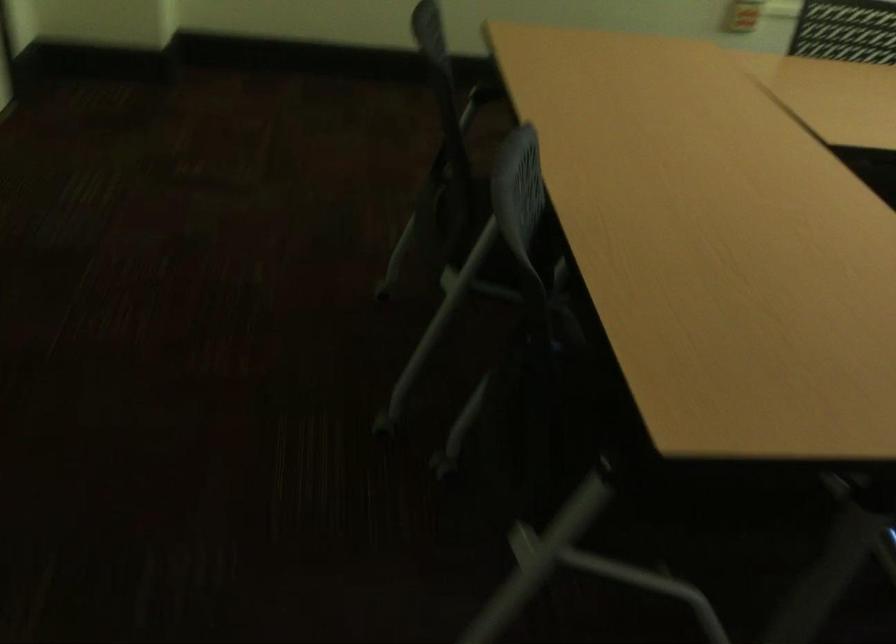
Identify the location of dark chair sitting surface. (501, 214).